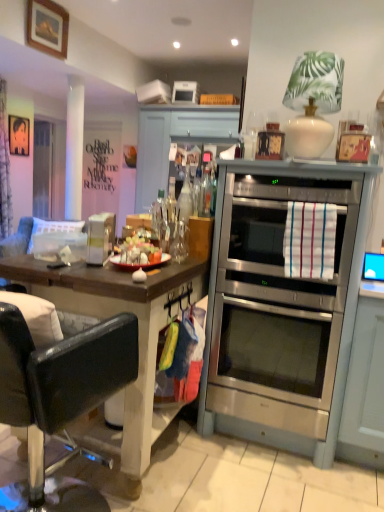
What do you see at coordinates (186, 92) in the screenshot?
I see `white plastic toaster at upper center` at bounding box center [186, 92].

The width and height of the screenshot is (384, 512). Find the location of `wooden framed picture at upper left, positioned as the 2th picture frame in back-to-front order`. wooden framed picture at upper left, positioned as the 2th picture frame in back-to-front order is located at coordinates (47, 28).

The width and height of the screenshot is (384, 512). What do you see at coordinates (373, 267) in the screenshot? I see `blue glossy monitor at right` at bounding box center [373, 267].

Describe the element at coordinates (19, 135) in the screenshot. I see `metallic silver picture frame at upper left, the 1th picture frame viewed from the back` at that location.

Where is `stainless steel oven at center`? The image size is (384, 512). stainless steel oven at center is located at coordinates (281, 308).

From the image's perspective, is stainless steel oven at center on top of blue glossy monitor at right?

No, from the image's perspective, stainless steel oven at center is not over blue glossy monitor at right.

Which is correct: stainless steel oven at center is inside blue glossy monitor at right, or outside of it?

The correct answer is: outside.

Considering their positions, is stainless steel oven at center located in front of or behind blue glossy monitor at right?

stainless steel oven at center is in front of blue glossy monitor at right.

From a real-world perspective, is blue glossy monitor at right on stainless steel oven at center?

Correct, in the physical world, blue glossy monitor at right is higher than stainless steel oven at center.

Considering the sizes of objects blue glossy monitor at right and stainless steel oven at center in the image provided, who is thinner, blue glossy monitor at right or stainless steel oven at center?

Thinner between the two is blue glossy monitor at right.

From the image's perspective, is blue glossy monitor at right located beneath stainless steel oven at center?

No.

Is stainless steel oven at center located within blue glossy monitor at right?

No, stainless steel oven at center is not inside blue glossy monitor at right.

Which is closer, (46, 140) or (67, 400)?

The point (67, 400) is in front.

From a real-world perspective, is transparent glass door at left located beneath black leather chair at left?

Incorrect, from a real-world perspective, transparent glass door at left is higher than black leather chair at left.

Looking at this image, which object is positioned more to the right, transparent glass door at left or black leather chair at left?

black leather chair at left.

Considering the relative sizes of white plastic toaster at upper center and metallic silver picture frame at upper left, which is counted as the 2th picture frame, starting from the right, in the image provided, is white plastic toaster at upper center thinner than metallic silver picture frame at upper left, which is counted as the 2th picture frame, starting from the right,?

No, white plastic toaster at upper center is not thinner than metallic silver picture frame at upper left, which is counted as the 2th picture frame, starting from the right.

Is metallic silver picture frame at upper left, which is counted as the second picture frame, starting from the front, located within white plastic toaster at upper center?

Actually, metallic silver picture frame at upper left, which is counted as the second picture frame, starting from the front, is outside white plastic toaster at upper center.

Does white plastic toaster at upper center appear on the right side of metallic silver picture frame at upper left, which is counted as the 2th picture frame, starting from the right?

Indeed, white plastic toaster at upper center is positioned on the right side of metallic silver picture frame at upper left, which is counted as the 2th picture frame, starting from the right.

From the image's perspective, does white plastic toaster at upper center appear higher than metallic silver picture frame at upper left, the 1th picture frame viewed from the back?

Yes, from the image's perspective, white plastic toaster at upper center is over metallic silver picture frame at upper left, the 1th picture frame viewed from the back.

Is stainless steel oven at center oriented away from wooden framed picture at upper left, positioned as the 2th picture frame in back-to-front order?

No, stainless steel oven at center is not facing away from wooden framed picture at upper left, positioned as the 2th picture frame in back-to-front order.

From the picture: Is stainless steel oven at center to the right of wooden framed picture at upper left, which is the 2th picture frame in bottom-to-top order, from the viewer's perspective?

Yes, stainless steel oven at center is to the right of wooden framed picture at upper left, which is the 2th picture frame in bottom-to-top order.

Is stainless steel oven at center not inside wooden framed picture at upper left, marked as the 1th picture frame in a top-to-bottom arrangement?

stainless steel oven at center is positioned outside wooden framed picture at upper left, marked as the 1th picture frame in a top-to-bottom arrangement.

Between stainless steel oven at center and wooden framed picture at upper left, which ranks as the first picture frame in front-to-back order, which one has larger width?

With larger width is stainless steel oven at center.

From the image's perspective, which one is positioned lower, black leather chair at left or wooden framed picture at upper left, positioned as the 2th picture frame in back-to-front order?

black leather chair at left.

Does black leather chair at left have a greater height compared to wooden framed picture at upper left, marked as the 1th picture frame in a top-to-bottom arrangement?

Yes.

Looking at this image, which object is wider, black leather chair at left or wooden framed picture at upper left, positioned as the 2th picture frame in back-to-front order?

With larger width is black leather chair at left.

Who is taller, white plastic toaster at upper center or blue glossy monitor at right?

white plastic toaster at upper center is taller.

From a real-world perspective, does white plastic toaster at upper center sit lower than blue glossy monitor at right?

Incorrect, from a real-world perspective, white plastic toaster at upper center is higher than blue glossy monitor at right.

Is the surface of white plastic toaster at upper center in direct contact with blue glossy monitor at right?

white plastic toaster at upper center is not next to blue glossy monitor at right, and they're not touching.

Which is correct: white plastic toaster at upper center is inside blue glossy monitor at right, or outside of it?

white plastic toaster at upper center is located beyond the bounds of blue glossy monitor at right.

The width and height of the screenshot is (384, 512). In order to click on computer monitor behind the stainless steel oven at center in this screenshot , I will do `click(373, 267)`.

Where is `computer monitor that appears above the stainless steel oven at center (from a real-world perspective)`? This screenshot has height=512, width=384. computer monitor that appears above the stainless steel oven at center (from a real-world perspective) is located at coordinates (373, 267).

When comparing their distances from stainless steel oven at center, does white plastic toaster at upper center or wooden framed picture at upper left, marked as the 1th picture frame in a top-to-bottom arrangement, seem further?

white plastic toaster at upper center lies further to stainless steel oven at center than the other object.

Looking at the image, which one is located closer to wooden framed picture at upper left, marked as the 1th picture frame in a top-to-bottom arrangement, white plastic toaster at upper center or transparent glass door at left?

Based on the image, transparent glass door at left appears to be nearer to wooden framed picture at upper left, marked as the 1th picture frame in a top-to-bottom arrangement.

Based on their spatial positions, is blue glossy monitor at right or wooden framed picture at upper left, which ranks as the first picture frame in front-to-back order, closer to transparent glass door at left?

Among the two, wooden framed picture at upper left, which ranks as the first picture frame in front-to-back order, is located nearer to transparent glass door at left.

Based on the photo, from the image, which object appears to be farther from metallic silver picture frame at upper left, the 1th picture frame viewed from the back, black leather chair at left or blue glossy monitor at right?

The object further to metallic silver picture frame at upper left, the 1th picture frame viewed from the back, is blue glossy monitor at right.

From the image, which object appears to be farther from transparent glass door at left, white plastic toaster at upper center or wooden framed picture at upper left, which is the 2th picture frame in bottom-to-top order?

white plastic toaster at upper center.

Estimate the real-world distances between objects in this image. Which object is further from white plastic toaster at upper center, black leather chair at left or transparent glass door at left?

black leather chair at left is further to white plastic toaster at upper center.

When comparing their distances from stainless steel oven at center, does metallic silver picture frame at upper left, which is counted as the second picture frame, starting from the front, or blue glossy monitor at right seem further?

metallic silver picture frame at upper left, which is counted as the second picture frame, starting from the front, is further to stainless steel oven at center.

Considering their positions, is transparent glass door at left positioned further to blue glossy monitor at right than black leather chair at left?

transparent glass door at left is further to blue glossy monitor at right.

At what (x,y) coordinates should I click in order to perform the action: click on computer monitor between stainless steel oven at center and metallic silver picture frame at upper left, which is counted as the second picture frame, starting from the front, in the front-back direction. Please return your answer as a coordinate pair (x, y). This screenshot has height=512, width=384. Looking at the image, I should click on (373, 267).

The width and height of the screenshot is (384, 512). Identify the location of appliance between stainless steel oven at center and metallic silver picture frame at upper left, positioned as the 1th picture frame in bottom-to-top order, along the z-axis. (186, 92).

Find the location of a particular element. The height and width of the screenshot is (512, 384). picture frame between black leather chair at left and metallic silver picture frame at upper left, the 1th picture frame viewed from the left, along the z-axis is located at coordinates (47, 28).

Find the location of `chair between wooden framed picture at upper left, which ranks as the first picture frame in front-to-back order, and stainless steel oven at center vertically`. chair between wooden framed picture at upper left, which ranks as the first picture frame in front-to-back order, and stainless steel oven at center vertically is located at coordinates (59, 398).